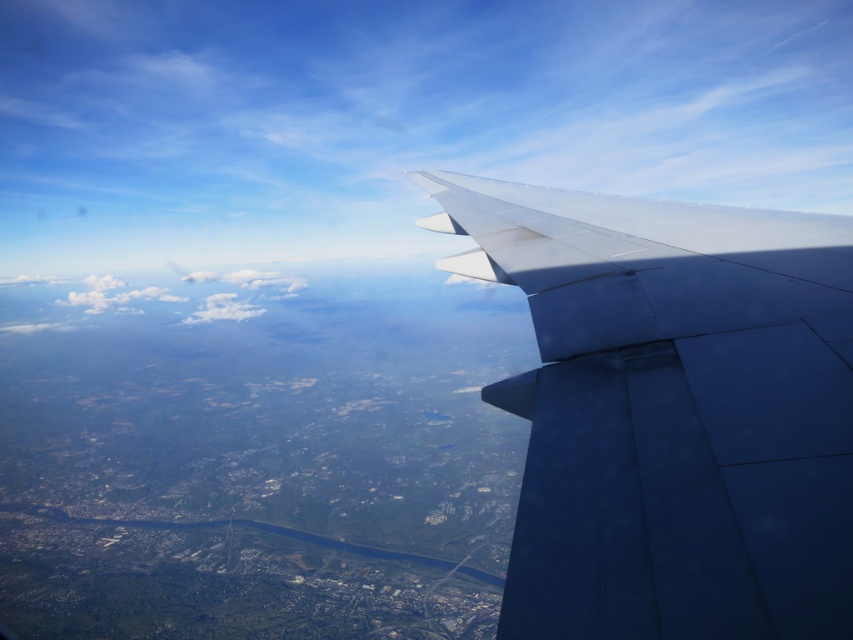
You are a passenger on the airplane and looking out the window. You see the satin blue wing at right and the white fluffy cloud at center. Which object takes up more area in your view?

The white fluffy cloud at center takes up more area in the view because the satin blue wing at right occupies less space than the white fluffy cloud at center.

You are a passenger seated by the window on an airplane. You notice the satin blue wing at right and the white fluffy cloud at center outside. Which object is positioned to the right side of the airplane window?

The satin blue wing at right is positioned to the right of the white fluffy cloud at center, so the satin blue wing at right is on the right side of the airplane window.

You are a pilot flying at 30,000 feet altitude. You notice the satin blue wing at right and the white fluffy cloud at center. How far apart are these two objects from each other?

The satin blue wing at right is 2143.04 feet away from the white fluffy cloud at center.